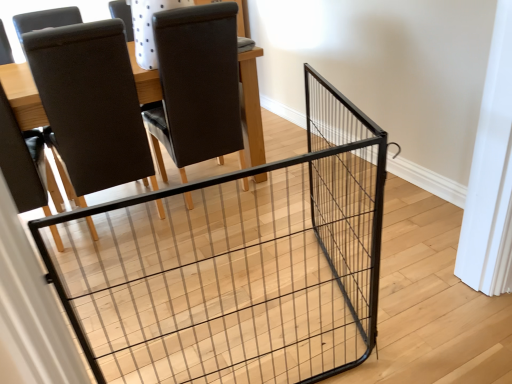
The height and width of the screenshot is (384, 512). In order to click on black wire mesh cage at center in this screenshot , I will do `click(237, 266)`.

The height and width of the screenshot is (384, 512). Describe the element at coordinates (237, 266) in the screenshot. I see `black wire mesh cage at center` at that location.

What is the approximate width of black wire mesh cage at center?

The width of black wire mesh cage at center is 2.36 inches.

In order to click on black wire mesh cage at center in this screenshot , I will do `click(237, 266)`.